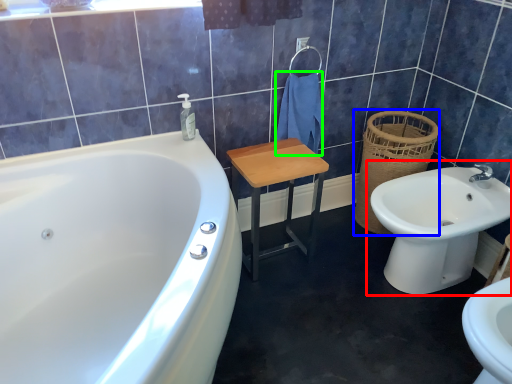
Question: Which is nearer to the sink (highlighted by a red box)? basket (highlighted by a blue box) or bath towel (highlighted by a green box).

Choices:
 (A) basket
 (B) bath towel

Answer: (A)